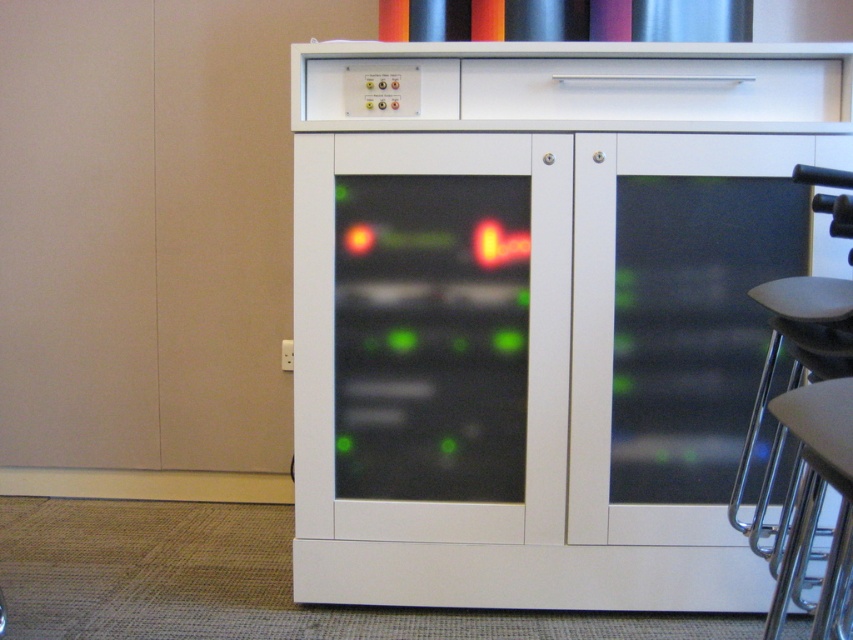
Question: Can you confirm if metallic gray seat at right is positioned below metallic silver bar stool at lower right?

Choices:
 (A) yes
 (B) no

Answer: (B)

Question: Among these points, which one is nearest to the camera?

Choices:
 (A) (834, 614)
 (B) (573, 300)
 (C) (821, 627)

Answer: (C)

Question: Which point is closer to the camera?

Choices:
 (A) metallic gray seat at right
 (B) white glossy cabinet at center
 (C) metallic silver bar stool at lower right

Answer: (C)

Question: Does white glossy cabinet at center have a lesser width compared to metallic silver bar stool at lower right?

Choices:
 (A) no
 (B) yes

Answer: (A)

Question: Observing the image, what is the correct spatial positioning of white glossy cabinet at center in reference to metallic gray seat at right?

Choices:
 (A) right
 (B) left

Answer: (B)

Question: Estimate the real-world distances between objects in this image. Which object is farther from the metallic silver bar stool at lower right?

Choices:
 (A) metallic gray seat at right
 (B) white glossy cabinet at center

Answer: (B)